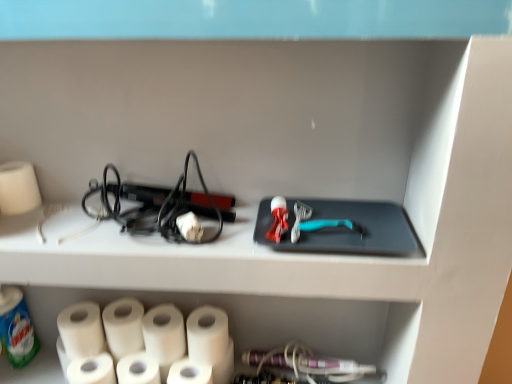
Question: In which direction should I rotate to look at white matte paper towel at lower center, the third paper towel from the right?

Choices:
 (A) right
 (B) left

Answer: (B)

Question: From the image's perspective, is white matte paper towel at lower center, which ranks as the second paper towel in right-to-left order, above white matte paper towel at left, the 1th paper towel from the left?

Choices:
 (A) yes
 (B) no

Answer: (B)

Question: Considering the relative sizes of white matte paper towel at lower center, the 6th paper towel viewed from the left, and white matte paper towel at left, acting as the 7th paper towel starting from the right, in the image provided, is white matte paper towel at lower center, the 6th paper towel viewed from the left, wider than white matte paper towel at left, acting as the 7th paper towel starting from the right,?

Choices:
 (A) no
 (B) yes

Answer: (B)

Question: From a real-world perspective, is white matte paper towel at lower center, the 6th paper towel viewed from the left, under white matte paper towel at left, the 1th paper towel from the left?

Choices:
 (A) yes
 (B) no

Answer: (A)

Question: Considering the relative positions of white matte paper towel at lower center, which ranks as the second paper towel in right-to-left order, and white matte paper towel at left, the 1th paper towel from the left, in the image provided, is white matte paper towel at lower center, which ranks as the second paper towel in right-to-left order, to the left of white matte paper towel at left, the 1th paper towel from the left, from the viewer's perspective?

Choices:
 (A) no
 (B) yes

Answer: (A)

Question: From a real-world perspective, is white matte paper towel at lower center, which ranks as the second paper towel in right-to-left order, located higher than white matte paper towel at left, the 1th paper towel from the left?

Choices:
 (A) yes
 (B) no

Answer: (B)

Question: Is white matte paper towel at lower center, which ranks as the second paper towel in right-to-left order, directly adjacent to white matte paper towel at left, the 1th paper towel from the left?

Choices:
 (A) no
 (B) yes

Answer: (A)

Question: Does white matte toilet paper at lower left turn towards white matte paper towel at lower left, the 3th paper towel positioned from the left?

Choices:
 (A) no
 (B) yes

Answer: (A)

Question: Can you confirm if white matte toilet paper at lower left is smaller than white matte paper towel at lower left, the 3th paper towel positioned from the left?

Choices:
 (A) yes
 (B) no

Answer: (A)

Question: Considering the relative positions of white matte toilet paper at lower left and white matte paper towel at lower left, which is the 5th paper towel in right-to-left order, in the image provided, is white matte toilet paper at lower left in front of white matte paper towel at lower left, which is the 5th paper towel in right-to-left order,?

Choices:
 (A) yes
 (B) no

Answer: (A)

Question: Is white matte toilet paper at lower left far away from white matte paper towel at lower left, which is the 5th paper towel in right-to-left order?

Choices:
 (A) yes
 (B) no

Answer: (B)

Question: Can you confirm if white matte toilet paper at lower left is thinner than white matte paper towel at lower left, which is the 5th paper towel in right-to-left order?

Choices:
 (A) yes
 (B) no

Answer: (A)

Question: Can you confirm if white matte toilet paper at lower left is taller than white matte paper towel at lower left, the 3th paper towel positioned from the left?

Choices:
 (A) yes
 (B) no

Answer: (B)

Question: Considering the relative sizes of white matte paper towel at lower left, the 3th paper towel positioned from the left, and white matte toilet paper at lower left in the image provided, is white matte paper towel at lower left, the 3th paper towel positioned from the left, smaller than white matte toilet paper at lower left?

Choices:
 (A) yes
 (B) no

Answer: (B)